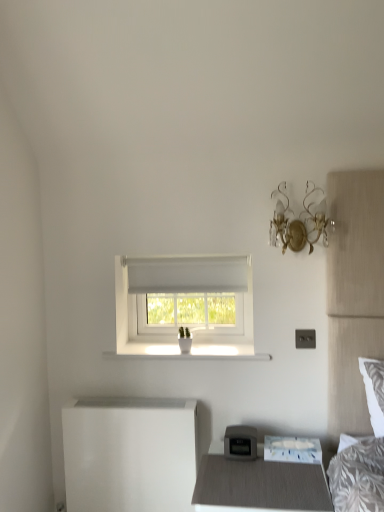
Question: Is point (236, 358) positioned closer to the camera than point (223, 487)?

Choices:
 (A) closer
 (B) farther

Answer: (B)

Question: From a real-world perspective, is white smooth window sill at center physically located above or below matte gray nightstand at lower center?

Choices:
 (A) above
 (B) below

Answer: (A)

Question: Considering the real-world distances, which object is closest to the white smooth window sill at center?

Choices:
 (A) white paper at lower right
 (B) white fabric window at center
 (C) matte gray nightstand at lower center
 (D) gold metallic wall sconce at upper right
 (E) white glossy changing table at lower left

Answer: (B)

Question: Estimate the real-world distances between objects in this image. Which object is farther from the white fabric window at center?

Choices:
 (A) white smooth window sill at center
 (B) gold metallic wall sconce at upper right
 (C) white glossy changing table at lower left
 (D) matte gray nightstand at lower center
 (E) white paper at lower right

Answer: (E)